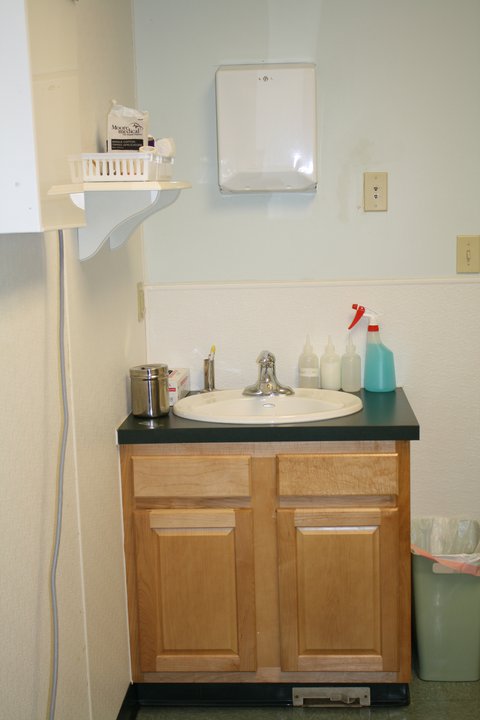
Find the location of a particular element. The width and height of the screenshot is (480, 720). trash is located at coordinates (454, 616).